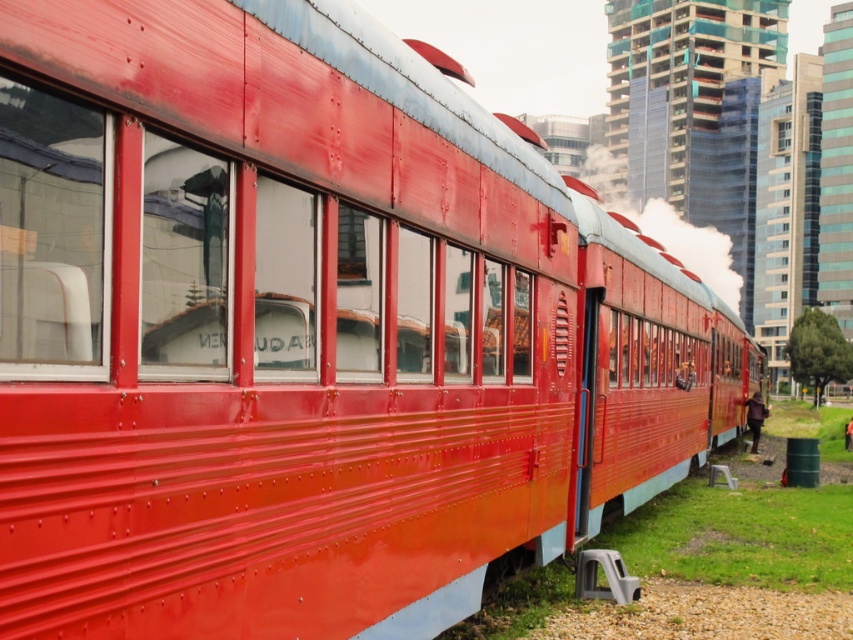
Can you confirm if dark brown leather jacket at lower right is taller than orange fabric jacket at lower right?

Indeed, dark brown leather jacket at lower right has a greater height compared to orange fabric jacket at lower right.

Who is more distant from viewer, (753, 438) or (850, 419)?

The point (850, 419) is more distant.

Does point (752, 394) come farther from viewer compared to point (848, 444)?

Yes.

At what (x,y) coordinates should I click in order to perform the action: click on dark brown leather jacket at lower right. Please return your answer as a coordinate pair (x, y). This screenshot has height=640, width=853. Looking at the image, I should click on (755, 417).

Between clear glass window at center and dark brown leather jacket at lower right, which one is positioned lower?

dark brown leather jacket at lower right

Does point (96, 230) lie in front of point (750, 424)?

Yes, it is in front of point (750, 424).

Who is more forward, (x=94, y=140) or (x=761, y=410)?

Point (x=94, y=140) is more forward.

Identify the location of clear glass window at center. (50, 234).

Consider the image. Which is above, clear glass window at center or cracked glass window at center?

clear glass window at center is higher up.

Is clear glass window at center positioned behind cracked glass window at center?

No.

You are a GUI agent. You are given a task and a screenshot of the screen. Output one action in this format:
    pyautogui.click(x=<x>, y=<y>)
    Task: Click on the clear glass window at center
    Image resolution: width=853 pixels, height=640 pixels.
    Given the screenshot: What is the action you would take?
    pyautogui.click(x=50, y=234)